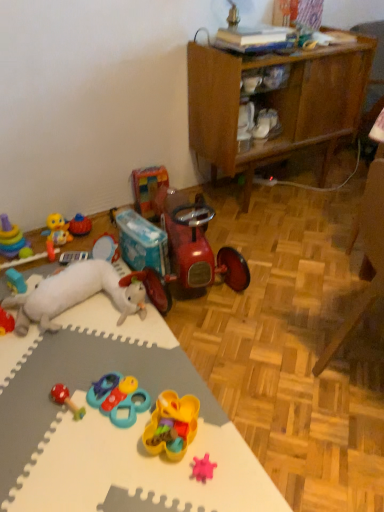
Find the location of a particular element. vacant area located to the right-hand side of multicolored plastic rings at left, which ranks as the 12th toy in right-to-left order is located at coordinates (49, 249).